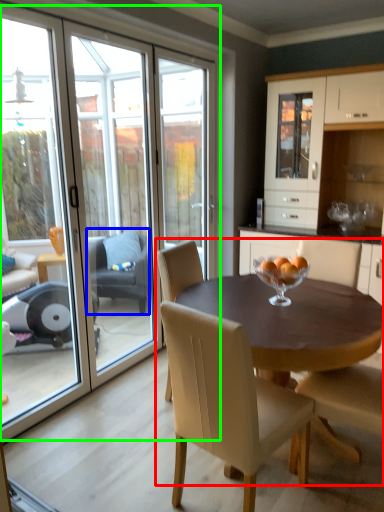
Question: Based on their relative distances, which object is farther from kitchen & dining room table (highlighted by a red box)? Choose from chair (highlighted by a blue box) and glass door (highlighted by a green box).

Choices:
 (A) chair
 (B) glass door

Answer: (A)